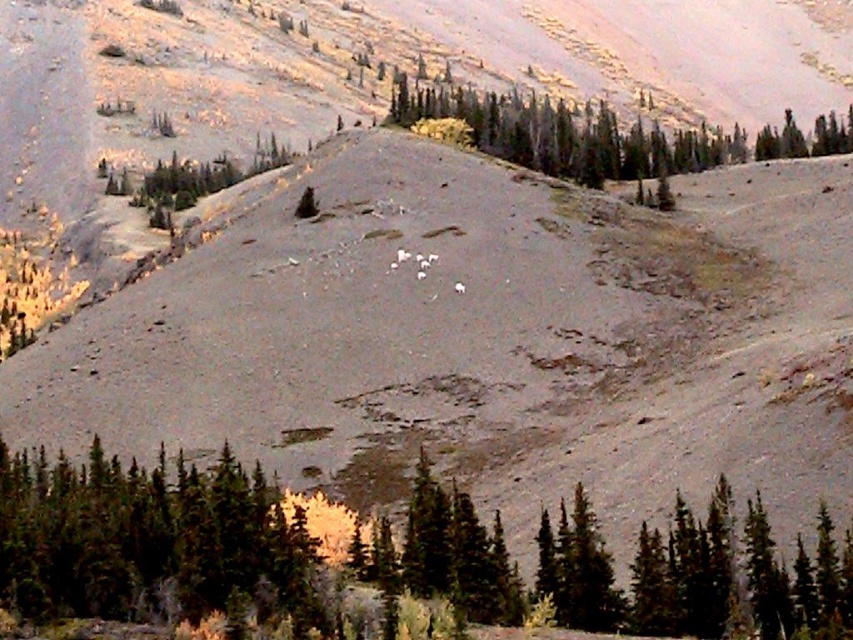
Question: Does green matte tree at center have a larger size compared to green textured trees at upper center?

Choices:
 (A) no
 (B) yes

Answer: (A)

Question: Is green matte tree at center thinner than green textured trees at upper center?

Choices:
 (A) no
 (B) yes

Answer: (B)

Question: Which point is closer to the camera?

Choices:
 (A) green textured trees at upper center
 (B) green matte tree at center

Answer: (B)

Question: Can you confirm if green matte tree at center is positioned to the right of green textured trees at upper center?

Choices:
 (A) yes
 (B) no

Answer: (B)

Question: Which point is farther to the camera?

Choices:
 (A) green textured trees at upper center
 (B) green matte tree at center

Answer: (A)